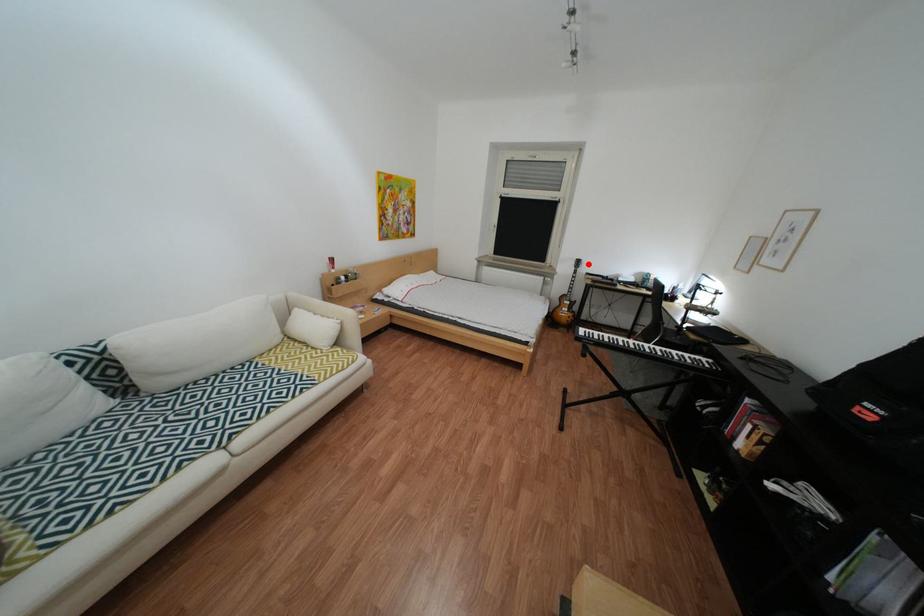
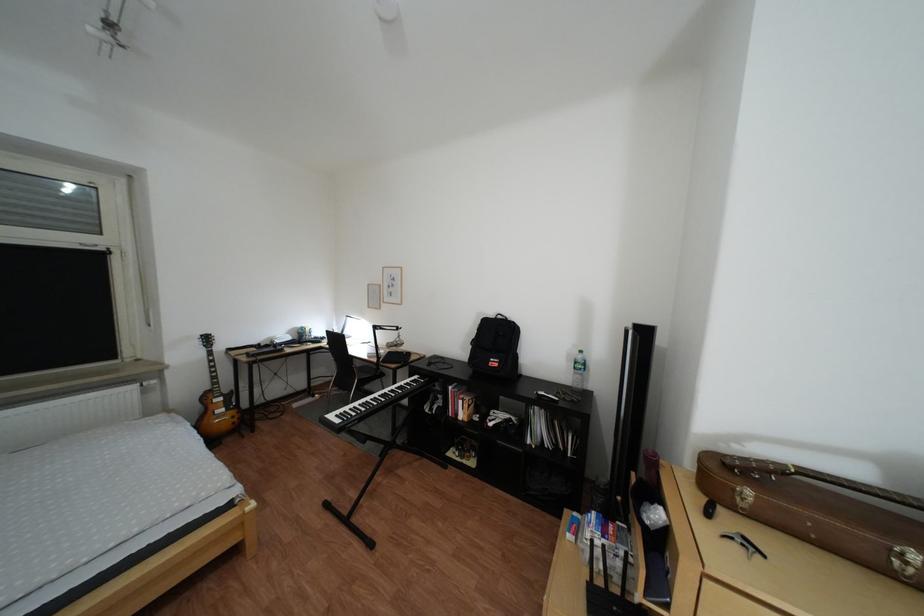
Question: A red point is marked in image1. In image2, is the corresponding 3D point closer to the camera or farther? Reply with the corresponding letter.

Choices:
 (A) The corresponding 3D point is closer.
 (B) The corresponding 3D point is farther.

Answer: (B)